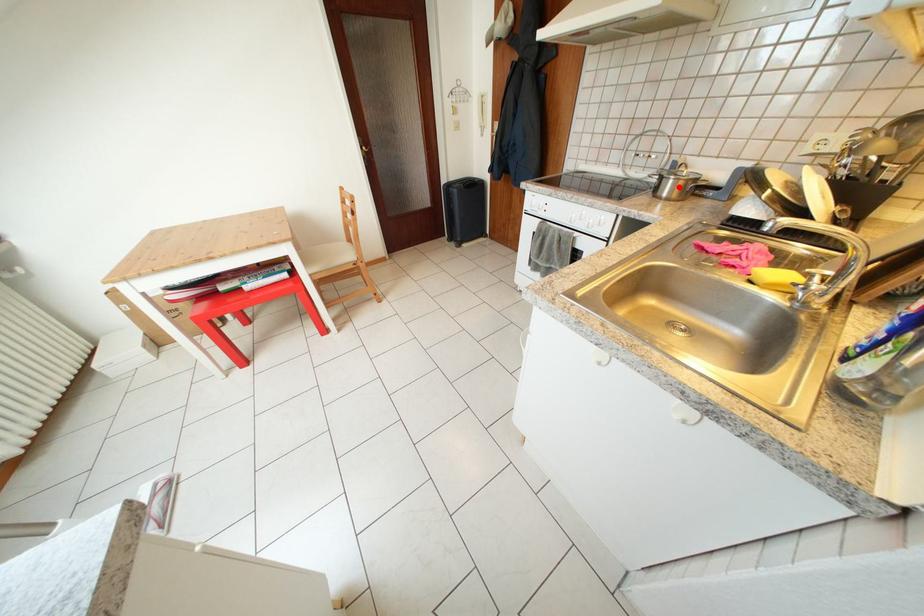
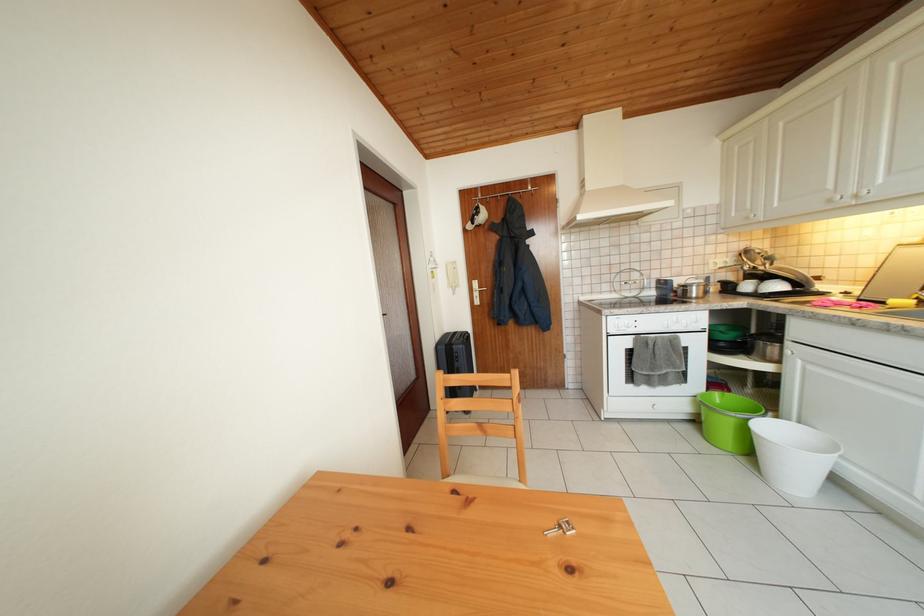
Locate, in the second image, the point that corresponds to the highlighted location in the first image.

(702, 294)